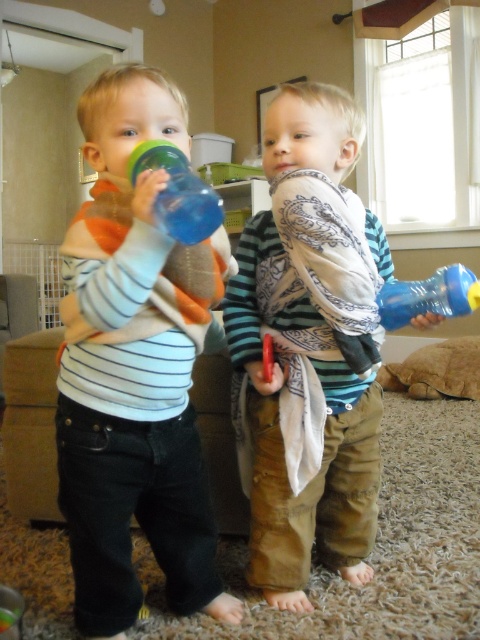
Question: Observing the image, what is the correct spatial positioning of matte plastic water bottle at left in reference to blue plastic bottle at center?

Choices:
 (A) left
 (B) right

Answer: (A)

Question: Based on their relative distances, which object is nearer to the blue plastic bottle at right?

Choices:
 (A) matte plastic water bottle at left
 (B) blue rubber water bottle at center

Answer: (B)

Question: Which of the following is the farthest from the observer?

Choices:
 (A) (398, 292)
 (B) (294, 257)

Answer: (A)

Question: Can you confirm if blue rubber water bottle at center is thinner than blue plastic bottle at right?

Choices:
 (A) yes
 (B) no

Answer: (B)

Question: Can you confirm if matte plastic water bottle at left is smaller than blue rubber water bottle at center?

Choices:
 (A) no
 (B) yes

Answer: (A)

Question: Which point appears farthest from the camera in this image?

Choices:
 (A) (82, 390)
 (B) (399, 317)
 (C) (288, 124)

Answer: (B)